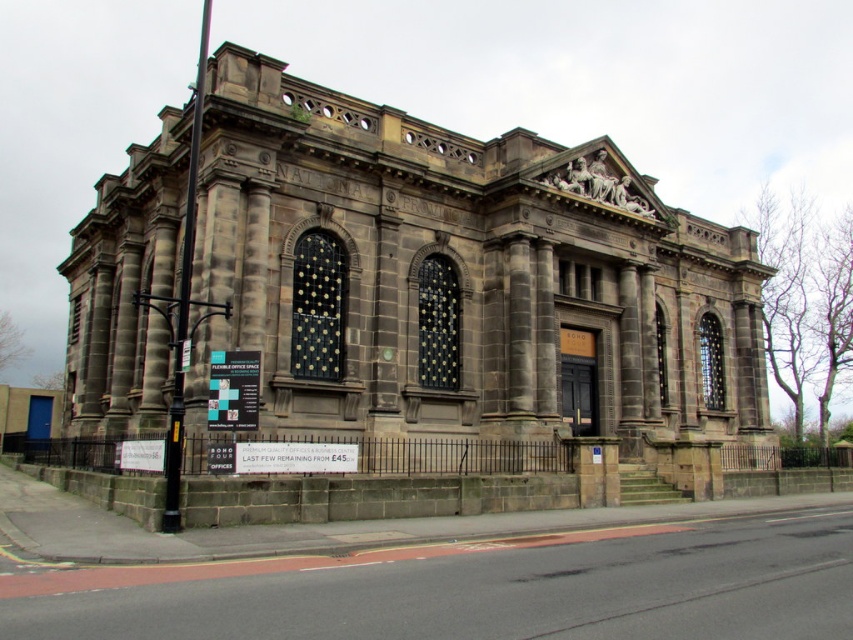
Question: Is dark gray stone church at center closer to camera compared to white plastic sign at lower left?

Choices:
 (A) no
 (B) yes

Answer: (B)

Question: From the image, what is the correct spatial relationship of dark gray stone church at center in relation to white plastic sign at lower left?

Choices:
 (A) left
 (B) right

Answer: (B)

Question: Does dark gray stone church at center have a smaller size compared to white plastic sign at lower left?

Choices:
 (A) no
 (B) yes

Answer: (A)

Question: Which object is farther from the camera taking this photo?

Choices:
 (A) white plastic sign at lower left
 (B) dark gray stone church at center

Answer: (A)